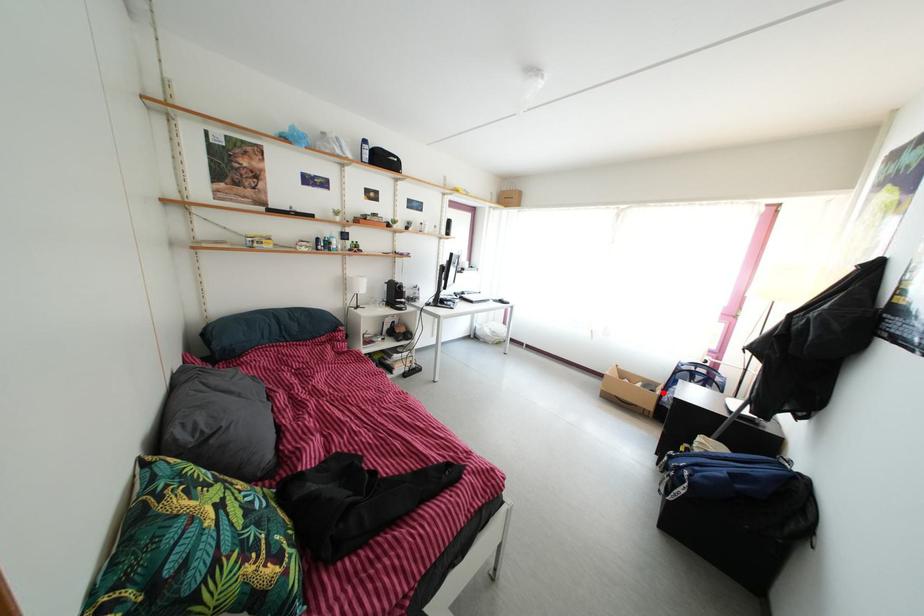
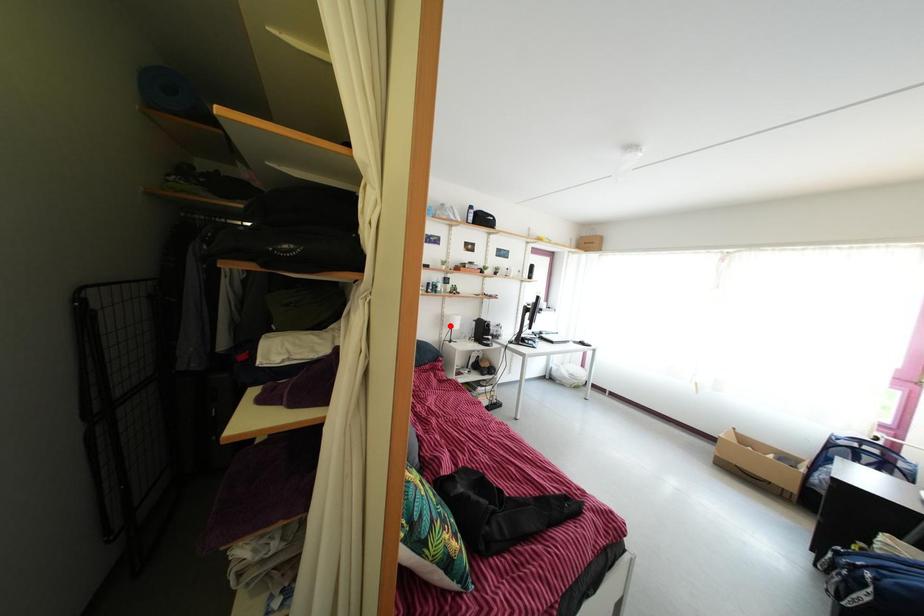
I am providing you with two images of the same scene from different viewpoints. A red point is marked on the first image and another point is marked on the second image. Are the points marked in image1 and image2 representing the same 3D position?

No